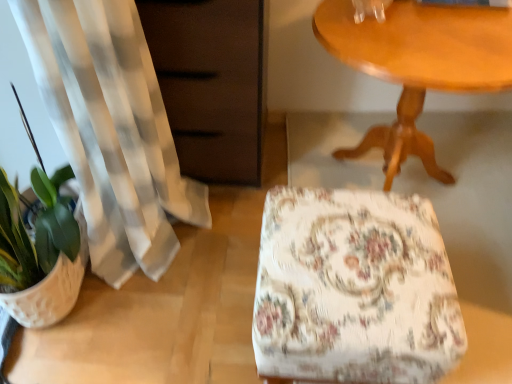
Question: Based on their positions, is matte brown dresser at left located to the left or right of floral fabric ottoman at center?

Choices:
 (A) left
 (B) right

Answer: (A)

Question: In terms of height, does matte brown dresser at left look taller or shorter compared to floral fabric ottoman at center?

Choices:
 (A) short
 (B) tall

Answer: (B)

Question: Which of these objects is positioned farthest from the white textured flowerpot at lower left?

Choices:
 (A) matte brown dresser at left
 (B) wooden table at upper right
 (C) floral fabric ottoman at center

Answer: (B)

Question: Which object is positioned closest to the wooden table at upper right?

Choices:
 (A) matte brown dresser at left
 (B) floral fabric ottoman at center
 (C) white textured flowerpot at lower left

Answer: (A)